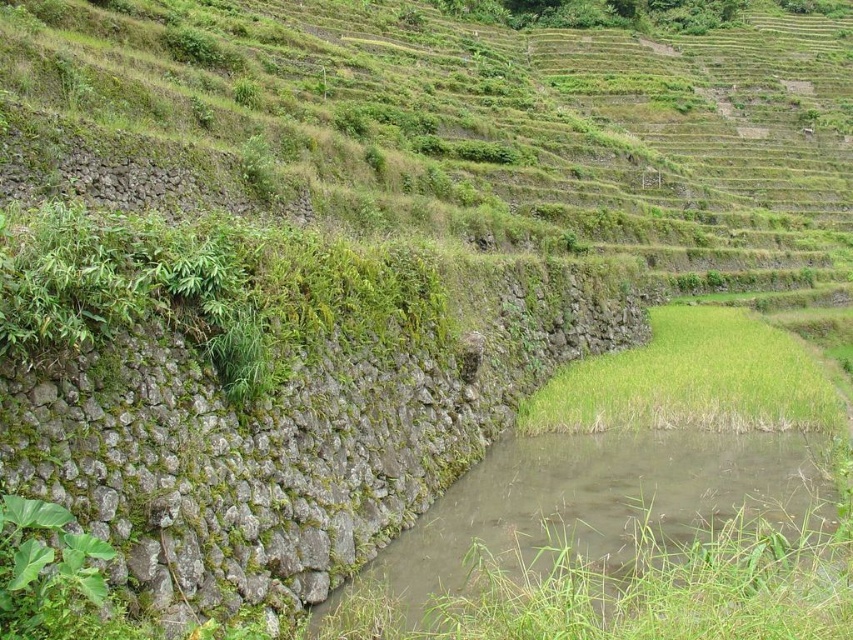
You are a hiker who wants to cross the muddy stone stream at lower center to reach the green grass at lower right. Is the stream directly in front of the grass, making it necessary to cross it to get there?

The muddy stone stream at lower center is positioned under green grass at lower right, so yes, the stream is directly in front of the grass, meaning you must cross it to reach the green grass at lower right.